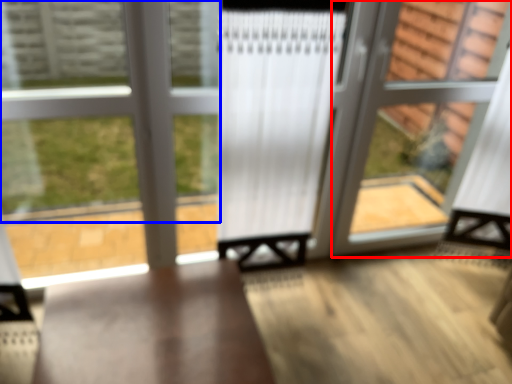
Question: Which of the following is the closest to the observer, screen door (highlighted by a red box) or bay window (highlighted by a blue box)?

Choices:
 (A) screen door
 (B) bay window

Answer: (B)